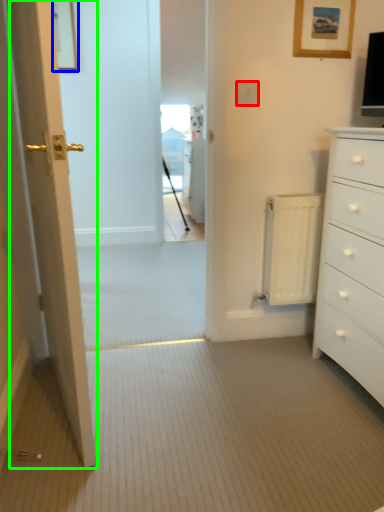
Question: Estimate the real-world distances between objects in this image. Which object is closer to electric outlet (highlighted by a red box), picture frame (highlighted by a blue box) or door (highlighted by a green box)?

Choices:
 (A) picture frame
 (B) door

Answer: (B)